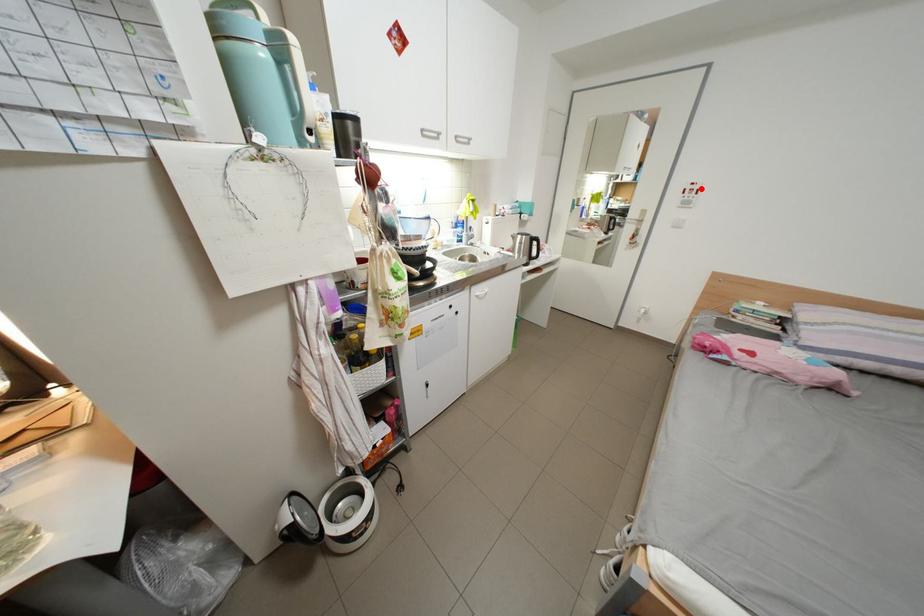
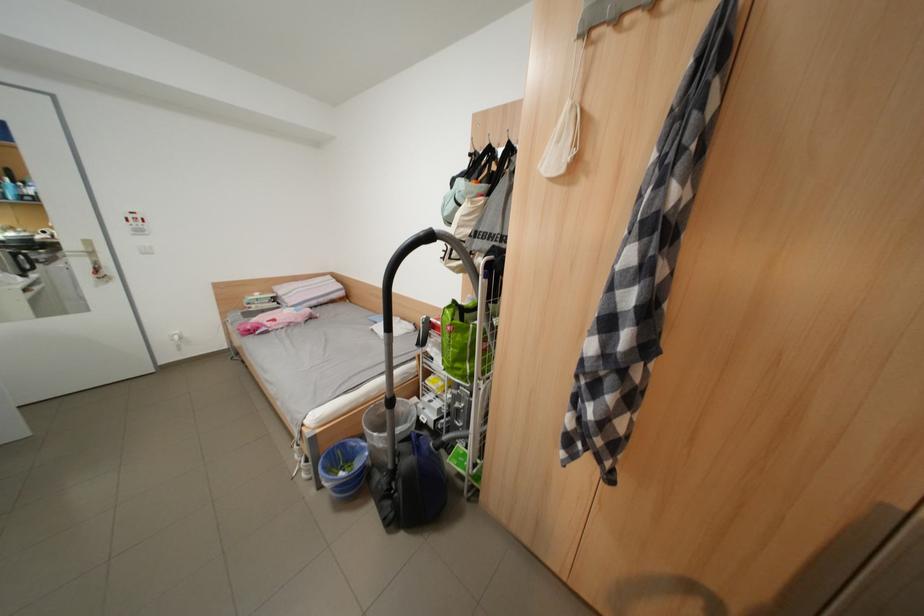
Where in the second image is the point corresponding to the highlighted location from the first image?

(142, 217)